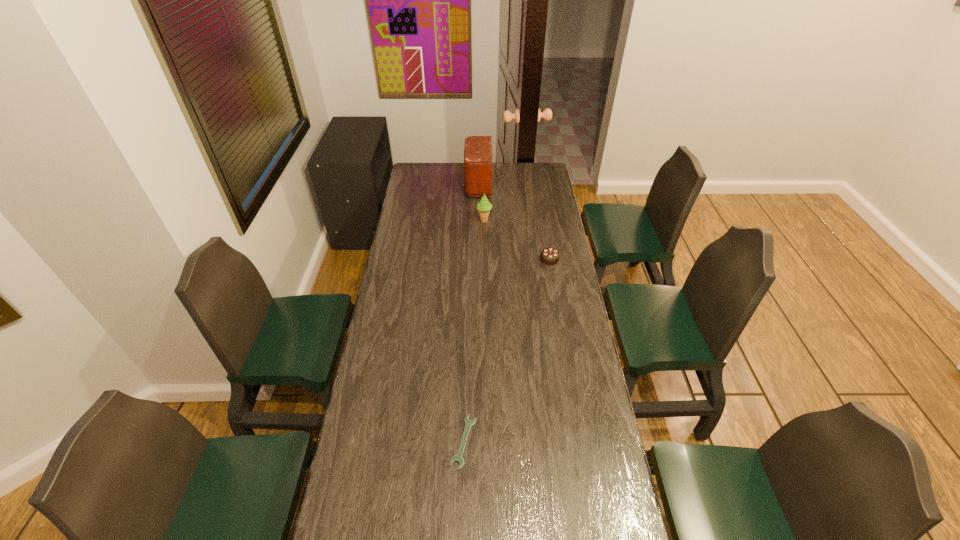
You are a GUI agent. You are given a task and a screenshot of the screen. Output one action in this format:
    pyautogui.click(x=<x>, y=<y>)
    Task: Click on the free space located on the front panel of the farthest object
    
    Given the screenshot: What is the action you would take?
    pyautogui.click(x=442, y=185)

Identify the location of free point located 0.270m on the front of the second tallest object. This screenshot has width=960, height=540. (485, 261).

Locate an element on the screen. The width and height of the screenshot is (960, 540). free point located on the front of the third tallest object is located at coordinates [x=555, y=289].

The height and width of the screenshot is (540, 960). Find the location of `vacant region located 0.160m on the right of the wrench`. vacant region located 0.160m on the right of the wrench is located at coordinates (526, 442).

This screenshot has width=960, height=540. Find the location of `object at the far edge`. object at the far edge is located at coordinates (478, 162).

Identify the location of object at the right edge. (550, 256).

This screenshot has height=540, width=960. I want to click on vacant space at the far edge of the desktop, so click(508, 168).

Locate an element on the screen. Image resolution: width=960 pixels, height=540 pixels. free space at the left edge is located at coordinates (414, 232).

The image size is (960, 540). In order to click on free space at the right edge of the desktop in this screenshot , I will do `click(545, 206)`.

In the image, there is a desktop. Where is `free space at the far right corner`? This screenshot has width=960, height=540. free space at the far right corner is located at coordinates (x=540, y=167).